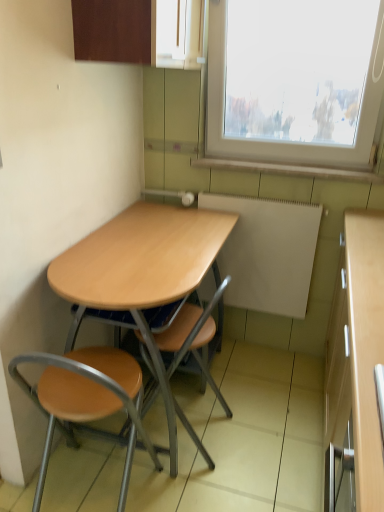
Question: From a real-world perspective, is wooden seat at lower left, the 1th chair positioned from the left, positioned over matte wood cabinet at upper center based on gravity?

Choices:
 (A) no
 (B) yes

Answer: (A)

Question: Does wooden seat at lower left, the second chair in the right-to-left sequence, have a lesser height compared to matte wood cabinet at upper center?

Choices:
 (A) yes
 (B) no

Answer: (B)

Question: From a real-world perspective, does wooden seat at lower left, the 1th chair positioned from the left, sit lower than matte wood cabinet at upper center?

Choices:
 (A) yes
 (B) no

Answer: (A)

Question: Can you confirm if wooden seat at lower left, the 1th chair positioned from the left, is positioned to the right of matte wood cabinet at upper center?

Choices:
 (A) no
 (B) yes

Answer: (A)

Question: Is there a large distance between wooden seat at lower left, the second chair in the right-to-left sequence, and matte wood cabinet at upper center?

Choices:
 (A) no
 (B) yes

Answer: (B)

Question: Is white matte radiator at center to the left or to the right of wooden table at center in the image?

Choices:
 (A) right
 (B) left

Answer: (A)

Question: From their relative heights in the image, would you say white matte radiator at center is taller or shorter than wooden table at center?

Choices:
 (A) tall
 (B) short

Answer: (B)

Question: Would you say white matte radiator at center is inside or outside wooden table at center?

Choices:
 (A) outside
 (B) inside

Answer: (A)

Question: From the image's perspective, is white matte radiator at center above or below wooden table at center?

Choices:
 (A) below
 (B) above

Answer: (B)

Question: In the image, is white matte radiator at center on the left side or the right side of matte wood cabinet at upper center?

Choices:
 (A) right
 (B) left

Answer: (A)

Question: From the image's perspective, is white matte radiator at center positioned above or below matte wood cabinet at upper center?

Choices:
 (A) below
 (B) above

Answer: (A)

Question: Is white matte radiator at center wider or thinner than matte wood cabinet at upper center?

Choices:
 (A) wide
 (B) thin

Answer: (B)

Question: Based on their sizes in the image, would you say white matte radiator at center is bigger or smaller than matte wood cabinet at upper center?

Choices:
 (A) small
 (B) big

Answer: (A)

Question: Considering the relative positions of matte wood cabinet at upper center and white matte radiator at center in the image provided, is matte wood cabinet at upper center to the left or to the right of white matte radiator at center?

Choices:
 (A) right
 (B) left

Answer: (B)

Question: From a real-world perspective, is matte wood cabinet at upper center above or below white matte radiator at center?

Choices:
 (A) below
 (B) above

Answer: (B)